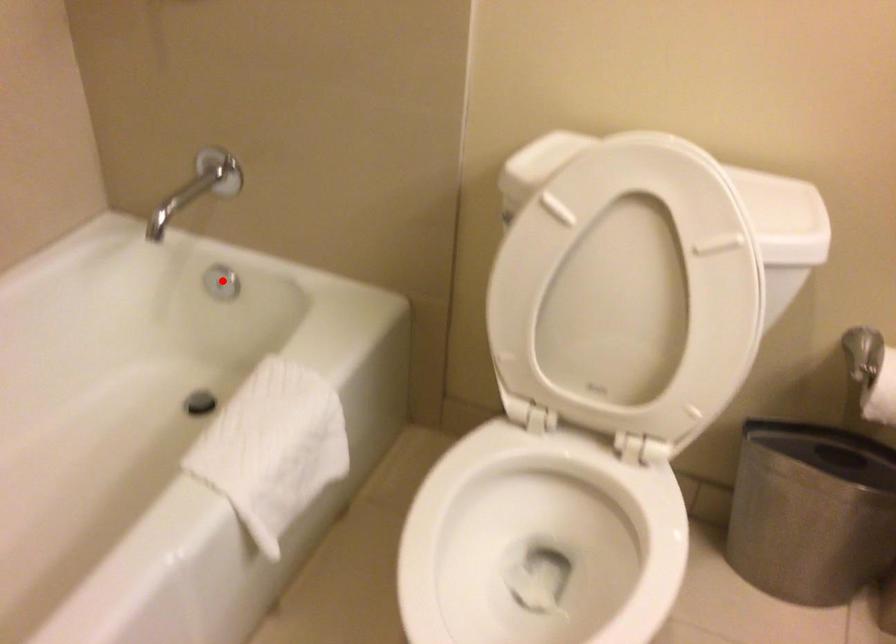
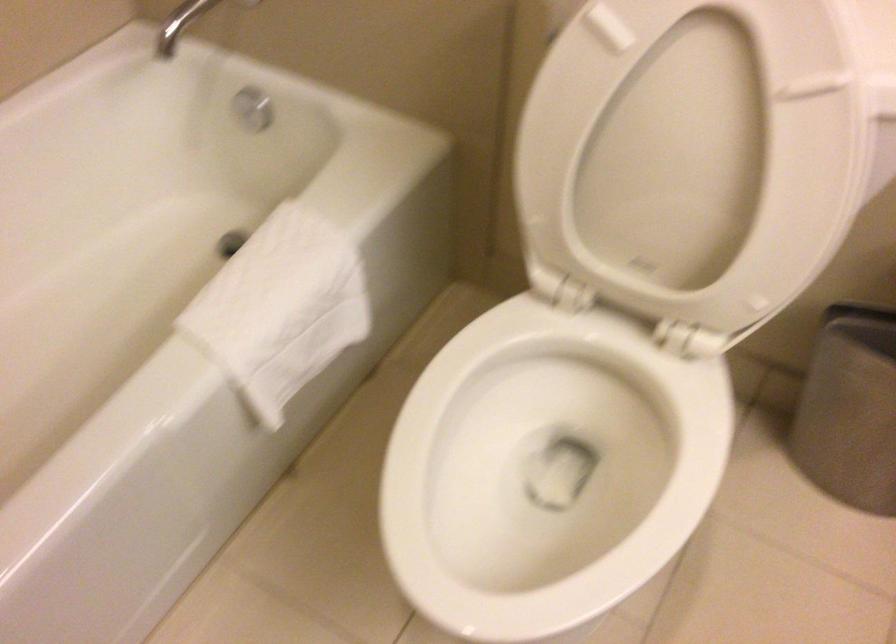
Question: A red point is marked in image1. In image2, is the corresponding 3D point closer to the camera or farther? Reply with the corresponding letter.

Choices:
 (A) The corresponding 3D point is closer.
 (B) The corresponding 3D point is farther.

Answer: (A)